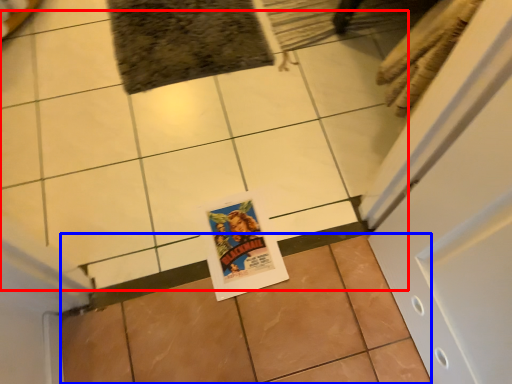
Question: Among these objects, which one is farthest to the camera, ceramic tile (highlighted by a red box) or ceramic tile (highlighted by a blue box)?

Choices:
 (A) ceramic tile
 (B) ceramic tile

Answer: (A)